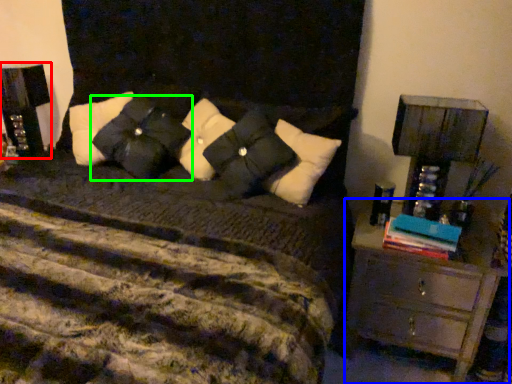
Question: Which object is positioned closest to nightstand (highlighted by a red box)? Select from chest of drawers (highlighted by a blue box) and pillow (highlighted by a green box).

Choices:
 (A) chest of drawers
 (B) pillow

Answer: (B)